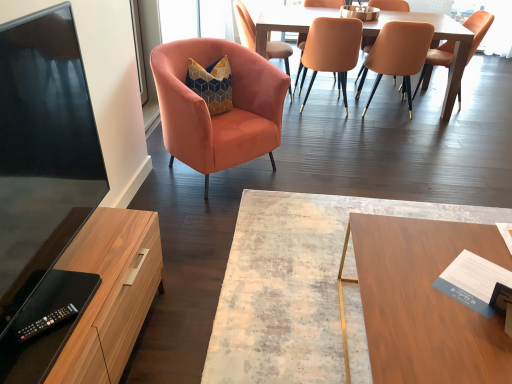
Find the location of a particular element. The width and height of the screenshot is (512, 384). free spot in front of matte orange chair at upper center, which appears as the fifth chair when viewed from the left is located at coordinates (394, 129).